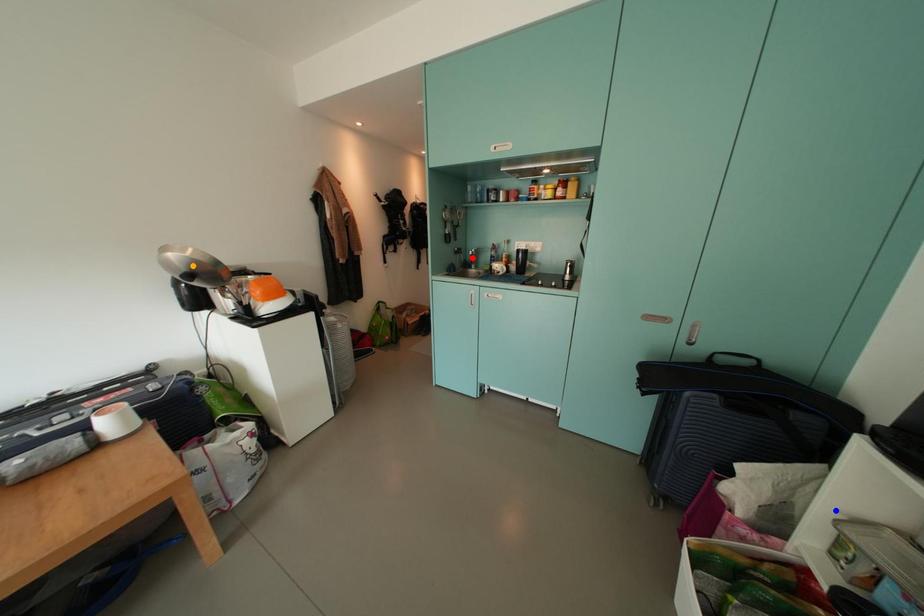
Order these from nearest to farthest:
- orange point
- blue point
- red point

blue point → orange point → red point